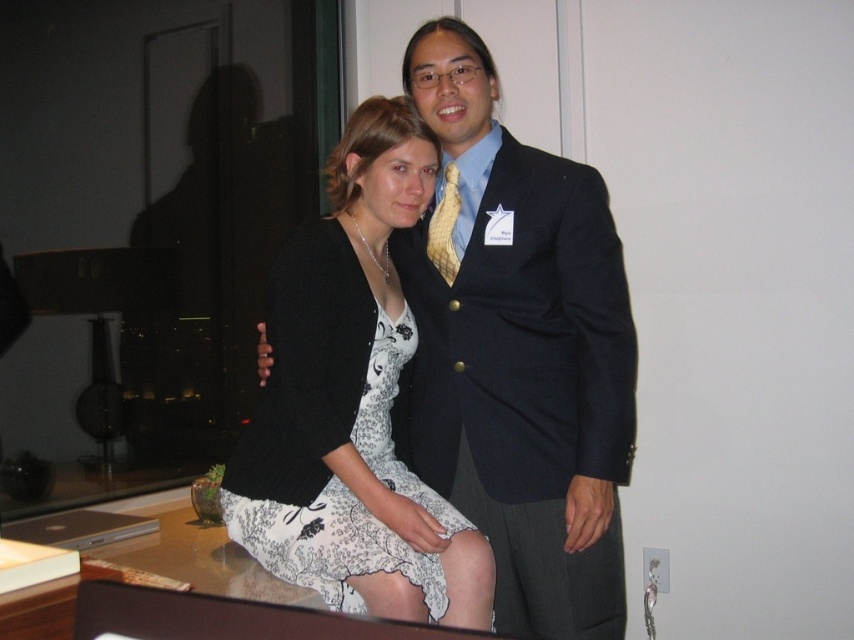
I want to click on white floral dress at center, so click(x=352, y=404).

Is white floral dress at center taller than yellow woven tie at center?

Indeed, white floral dress at center has a greater height compared to yellow woven tie at center.

The height and width of the screenshot is (640, 854). In order to click on white floral dress at center in this screenshot , I will do `click(352, 404)`.

The height and width of the screenshot is (640, 854). In order to click on white floral dress at center in this screenshot , I will do `click(352, 404)`.

Can you confirm if navy blue suit at center is positioned to the left of white floral dress at center?

In fact, navy blue suit at center is to the right of white floral dress at center.

The height and width of the screenshot is (640, 854). What do you see at coordinates (524, 380) in the screenshot? I see `navy blue suit at center` at bounding box center [524, 380].

Locate an element on the screen. The image size is (854, 640). navy blue suit at center is located at coordinates (524, 380).

Does navy blue suit at center appear under yellow woven tie at center?

Indeed, navy blue suit at center is positioned under yellow woven tie at center.

Which is more to the left, navy blue suit at center or yellow woven tie at center?

Positioned to the left is yellow woven tie at center.

Locate an element on the screen. The width and height of the screenshot is (854, 640). navy blue suit at center is located at coordinates (524, 380).